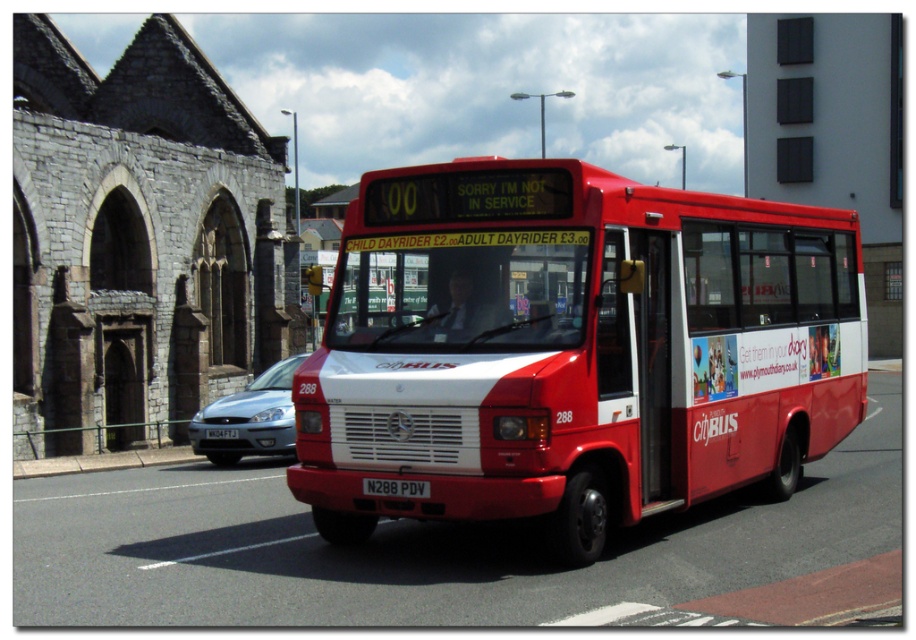
Does black plastic license plate at center have a greater height compared to white plastic license plate at center?

No, black plastic license plate at center is not taller than white plastic license plate at center.

The image size is (916, 640). Find the location of `black plastic license plate at center`. black plastic license plate at center is located at coordinates (396, 486).

The image size is (916, 640). Find the location of `black plastic license plate at center`. black plastic license plate at center is located at coordinates (396, 486).

Does gray stone church at center lie in front of metallic silver car at center-left?

No, it is not.

Is gray stone church at center shorter than metallic silver car at center-left?

Incorrect, gray stone church at center's height does not fall short of metallic silver car at center-left's.

Which is behind, point (129, 413) or point (214, 426)?

The point (129, 413) is behind.

At what (x,y) coordinates should I click in order to perform the action: click on gray stone church at center. Please return your answer as a coordinate pair (x, y). Image resolution: width=916 pixels, height=640 pixels. Looking at the image, I should click on (138, 241).

How much distance is there between metallic silver car at center-left and white plastic license plate at center?

metallic silver car at center-left is 34.81 inches away from white plastic license plate at center.

Which is more to the left, metallic silver car at center-left or white plastic license plate at center?

Positioned to the left is white plastic license plate at center.

Who is more distant from viewer, [256,387] or [205,433]?

The point [256,387] is behind.

At what (x,y) coordinates should I click in order to perform the action: click on metallic silver car at center-left. Please return your answer as a coordinate pair (x, y). Image resolution: width=916 pixels, height=640 pixels. Looking at the image, I should click on (249, 417).